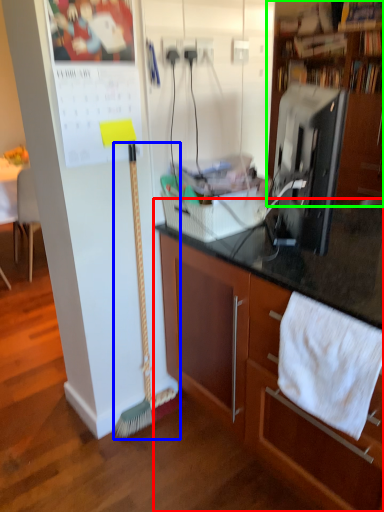
Question: Which object is the closest to the cabinetry (highlighted by a red box)? Choose among these: brush (highlighted by a blue box) or cabinetry (highlighted by a green box).

Choices:
 (A) brush
 (B) cabinetry

Answer: (A)